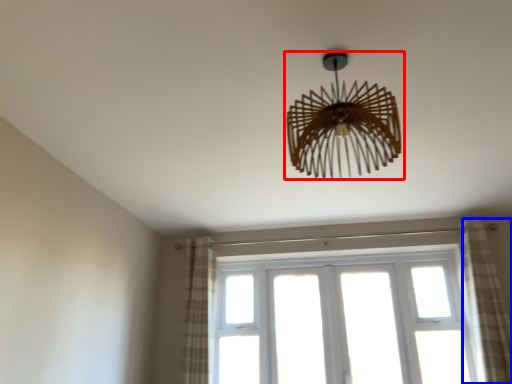
Question: Which of the following is the farthest to the observer, lamp (highlighted by a red box) or curtain (highlighted by a blue box)?

Choices:
 (A) lamp
 (B) curtain

Answer: (B)